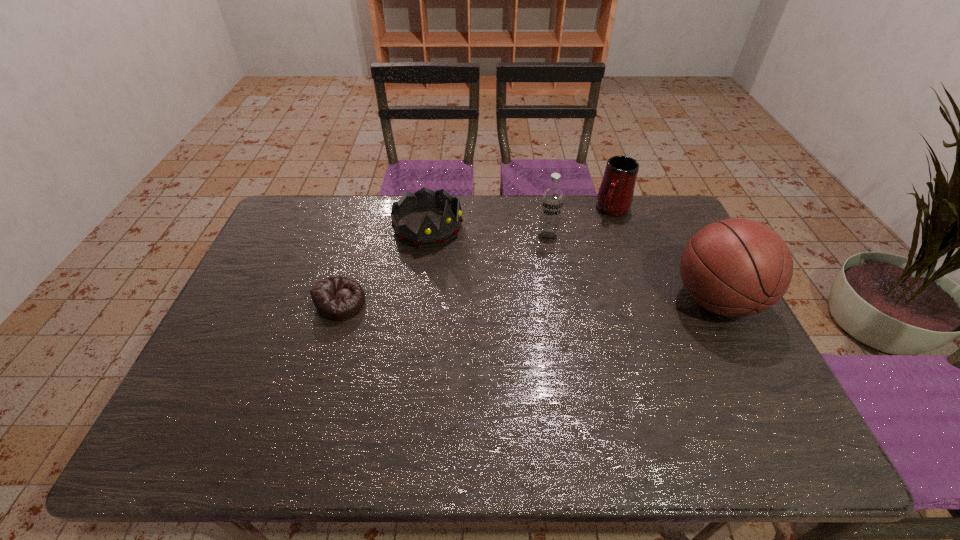
The image size is (960, 540). What are the coordinates of `basketball that is at the right edge` in the screenshot? It's located at (734, 267).

The image size is (960, 540). I want to click on mug present at the right edge, so click(x=615, y=195).

Identify the location of object that is at the far right corner. (615, 195).

Where is `vacant point at the far edge`? The image size is (960, 540). vacant point at the far edge is located at coordinates (x=512, y=198).

In the image, there is a desktop. In order to click on vacant space at the near edge in this screenshot , I will do `click(580, 398)`.

Find the location of a particular element. vacant region at the left edge of the desktop is located at coordinates (237, 355).

In the image, there is a desktop. Where is `vacant region at the right edge`? Image resolution: width=960 pixels, height=540 pixels. vacant region at the right edge is located at coordinates (659, 247).

Find the location of a particular element. The width and height of the screenshot is (960, 540). vacant space at the far left corner of the desktop is located at coordinates (279, 228).

Find the location of a particular element. This screenshot has height=540, width=960. free region at the far right corner of the desktop is located at coordinates (673, 206).

Locate an element on the screen. The height and width of the screenshot is (540, 960). vacant space in between the rightmost object and the tiara is located at coordinates (572, 264).